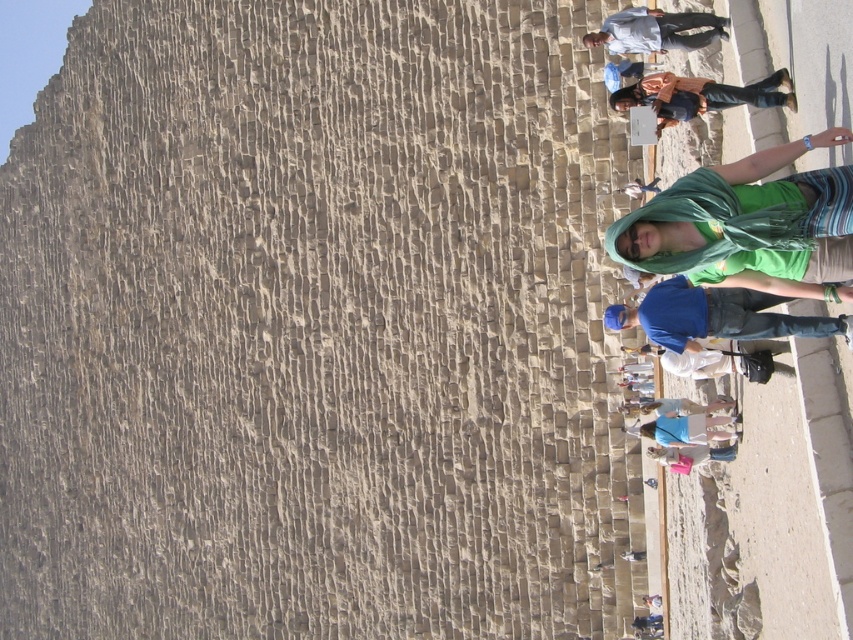
You are a GUI agent. You are given a task and a screenshot of the screen. Output one action in this format:
    pyautogui.click(x=<x>, y=<y>)
    Task: Click on the orange fabric hoodie at upper right
    The image size is (853, 640).
    Given the screenshot: What is the action you would take?
    pyautogui.click(x=700, y=96)

Is orange fabric hoodie at upper right thinner than light blue shirt at upper right?

Yes.

Which is in front, point (718, 102) or point (671, 36)?

Point (718, 102)

Where is `orange fabric hoodie at upper right`? orange fabric hoodie at upper right is located at coordinates (700, 96).